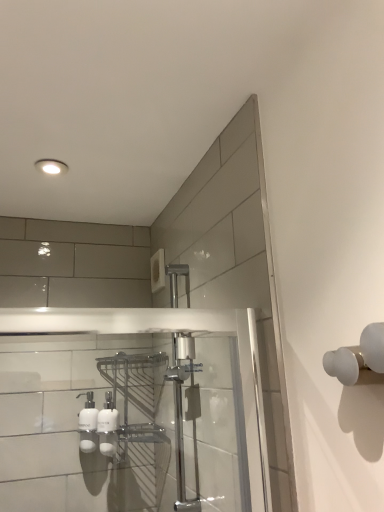
In order to face polished chrome faucet at center, should I rotate leftwards or rightwards?

Rotate your view left by about 2.128°.

Image resolution: width=384 pixels, height=512 pixels. In order to click on polished chrome faucet at center in this screenshot , I will do `click(182, 417)`.

The image size is (384, 512). What do you see at coordinates (182, 417) in the screenshot? I see `polished chrome faucet at center` at bounding box center [182, 417].

Image resolution: width=384 pixels, height=512 pixels. Find the location of `polished chrome faucet at center`. polished chrome faucet at center is located at coordinates (182, 417).